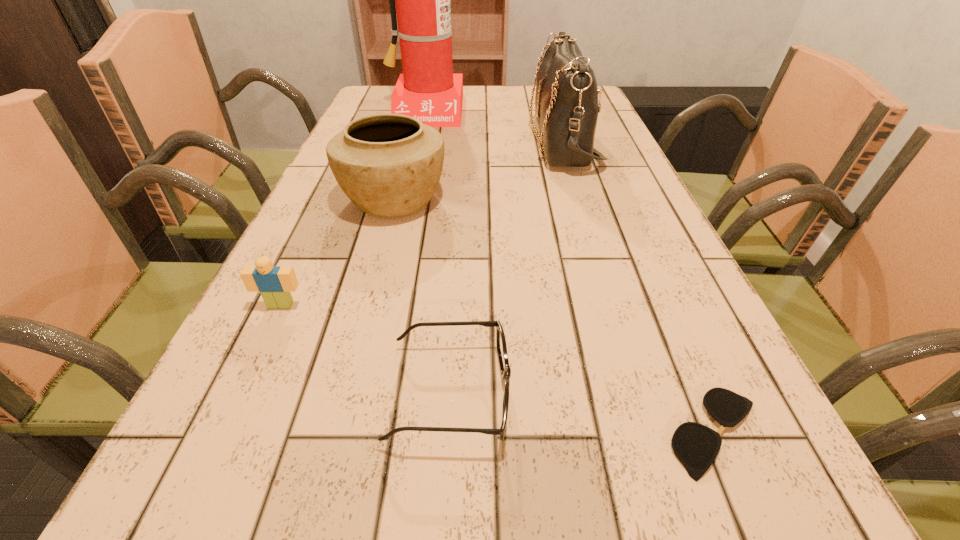
You are a GUI agent. You are given a task and a screenshot of the screen. Output one action in this format:
    pyautogui.click(x=<x>, y=<y>)
    Task: Click on the vacant space that satisfies the following two spatial constraints: 1. on the face of the third nearest object; 2. on the right side of the shortest object
    This screenshot has width=960, height=540.
    Given the screenshot: What is the action you would take?
    pyautogui.click(x=221, y=433)

Identify the location of vacant space that satisfies the following two spatial constraints: 1. on the front-facing side of the right spectacles; 2. on the left side of the fire extinguisher. This screenshot has height=540, width=960. (348, 433).

At what (x,y) coordinates should I click in order to perform the action: click on vacant space that satisfies the following two spatial constraints: 1. on the front-facing side of the taller spectacles; 2. on the back side of the shortest object. Please return your answer as a coordinate pair (x, y). This screenshot has height=540, width=960. Looking at the image, I should click on (447, 433).

The width and height of the screenshot is (960, 540). Identify the location of vacant space that satisfies the following two spatial constraints: 1. on the front-facing side of the shorter spectacles; 2. on the left side of the tallest object. (x=348, y=433).

You are a GUI agent. You are given a task and a screenshot of the screen. Output one action in this format:
    pyautogui.click(x=<x>, y=<y>)
    Task: Click on the vacant space that satisfies the following two spatial constraints: 1. on the front side of the right spectacles; 2. on the right side of the third tallest object
    Image resolution: width=960 pixels, height=540 pixels.
    Given the screenshot: What is the action you would take?
    pyautogui.click(x=331, y=433)